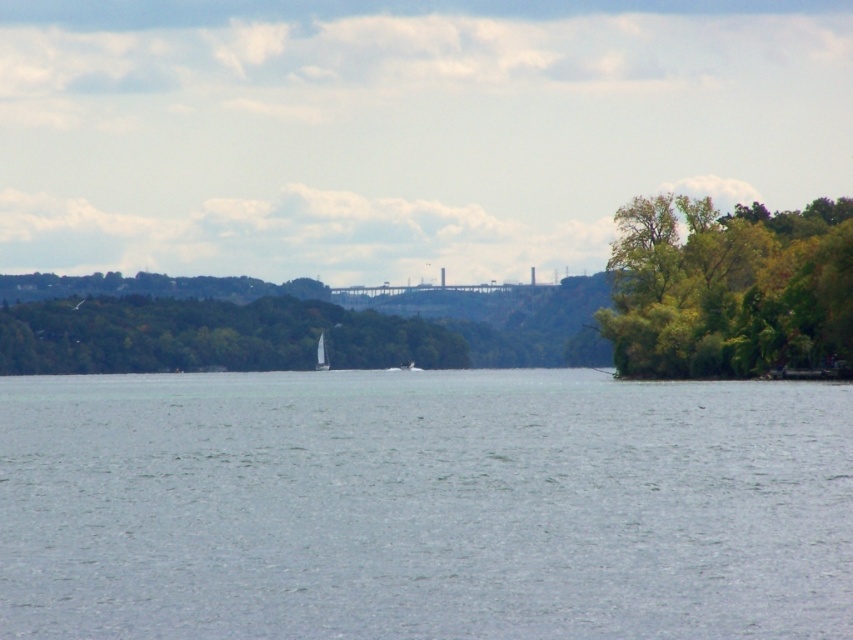
Does clear water at center appear under green leafy trees at right?

Yes.

What do you see at coordinates (422, 506) in the screenshot? Image resolution: width=853 pixels, height=640 pixels. I see `clear water at center` at bounding box center [422, 506].

Where is `clear water at center`? clear water at center is located at coordinates (422, 506).

Locate an element on the screen. The image size is (853, 640). clear water at center is located at coordinates (422, 506).

Does clear water at center have a greater height compared to white sailboat at center?

In fact, clear water at center may be shorter than white sailboat at center.

Does clear water at center lie in front of white sailboat at center?

Yes.

I want to click on clear water at center, so click(422, 506).

Locate an element on the screen. This screenshot has height=640, width=853. clear water at center is located at coordinates (422, 506).

Can you confirm if green leafy trees at right is positioned to the right of white sailboat at center?

Correct, you'll find green leafy trees at right to the right of white sailboat at center.

Does green leafy trees at right have a greater width compared to white sailboat at center?

Yes, green leafy trees at right is wider than white sailboat at center.

At what (x,y) coordinates should I click in order to perform the action: click on green leafy trees at right. Please return your answer as a coordinate pair (x, y). This screenshot has height=640, width=853. Looking at the image, I should click on (728, 289).